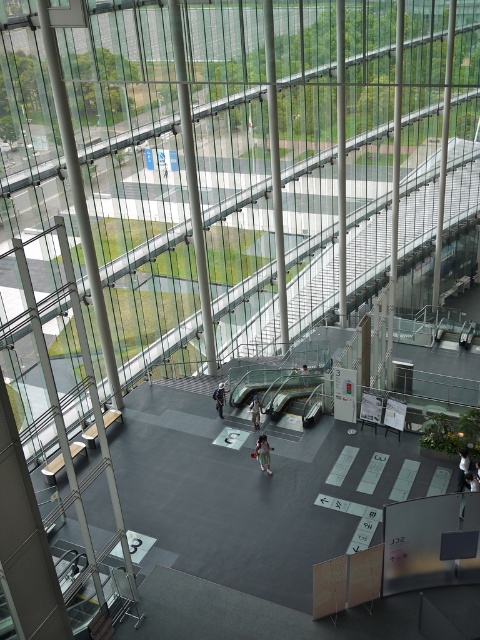
Question: Which object is the farthest from the light blue fabric jacket at center?

Choices:
 (A) light brown fabric pants at center
 (B) white fabric shirt at center
 (C) dark blue jeans at center

Answer: (B)

Question: Which object is closer to the camera taking this photo?

Choices:
 (A) white fabric shirt at center
 (B) light blue fabric jacket at center

Answer: (A)

Question: Can you confirm if white fabric shirt at center is positioned below light blue fabric jacket at center?

Choices:
 (A) yes
 (B) no

Answer: (A)

Question: Among these objects, which one is nearest to the camera?

Choices:
 (A) light brown fabric pants at center
 (B) dark blue jeans at center
 (C) light blue fabric jacket at center
 (D) white fabric shirt at center

Answer: (D)

Question: Does light brown fabric pants at center lie behind dark blue jeans at center?

Choices:
 (A) yes
 (B) no

Answer: (B)

Question: Considering the relative positions of light brown fabric pants at center and dark blue jeans at center in the image provided, where is light brown fabric pants at center located with respect to dark blue jeans at center?

Choices:
 (A) below
 (B) above

Answer: (A)